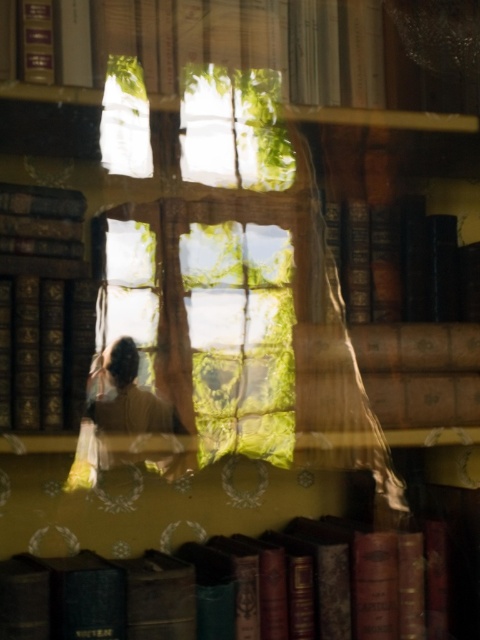
Is hardcover book at center taller than hardcover book at left?

Answer: In fact, hardcover book at center may be shorter than hardcover book at left.

Between hardcover book at center and hardcover book at left, which one has more height?

hardcover book at left

Between point (411, 237) and point (60, 362), which one is positioned in front?

Point (60, 362) is in front.

The image size is (480, 640). Identify the location of hardcover book at center. (406, 260).

Can you confirm if dark brown leather book at lower center is taller than hardcover book at left?

Incorrect, dark brown leather book at lower center's height is not larger of hardcover book at left's.

Is point (324, 548) less distant than point (26, 358)?

No.

Find the location of a particular element. The width and height of the screenshot is (480, 640). dark brown leather book at lower center is located at coordinates (309, 582).

Does matte gold book at upper center have a lesser width compared to hardcover book at center?

In fact, matte gold book at upper center might be wider than hardcover book at center.

Is matte gold book at upper center to the right of hardcover book at center from the viewer's perspective?

No, matte gold book at upper center is not to the right of hardcover book at center.

Describe the element at coordinates (193, 35) in the screenshot. The height and width of the screenshot is (640, 480). I see `matte gold book at upper center` at that location.

Locate an element on the screen. The image size is (480, 640). matte gold book at upper center is located at coordinates (193, 35).